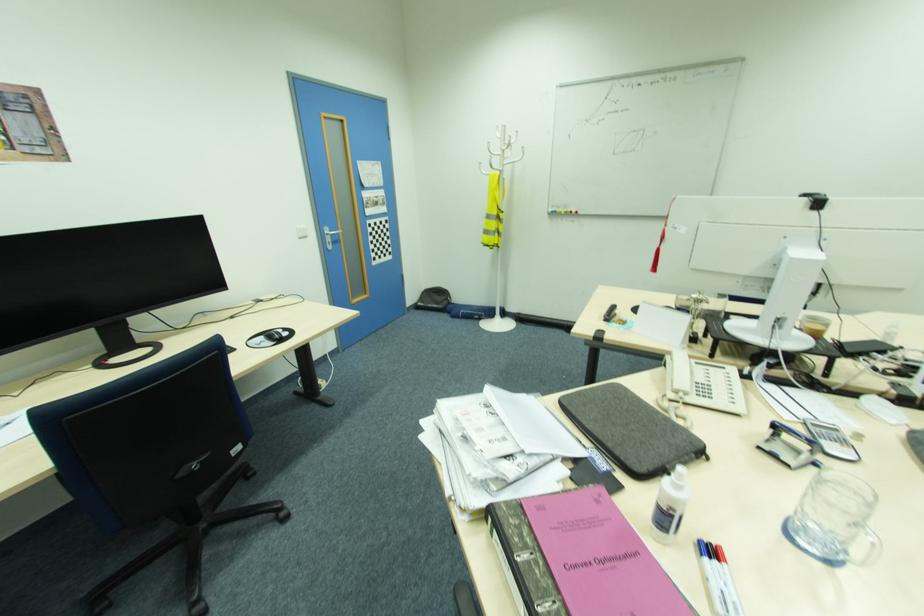
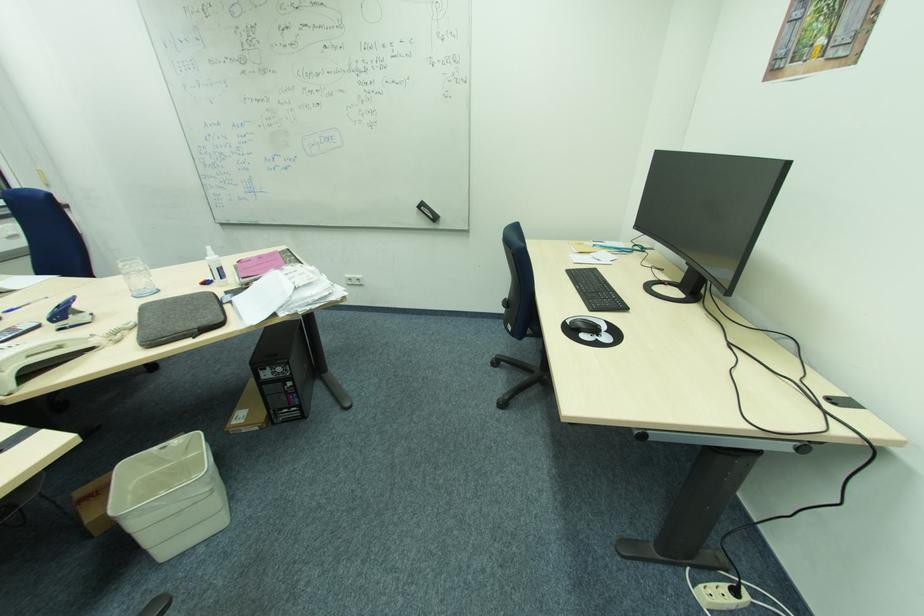
Locate, in the second image, the point that corresponds to point (590, 426) in the first image.

(222, 306)